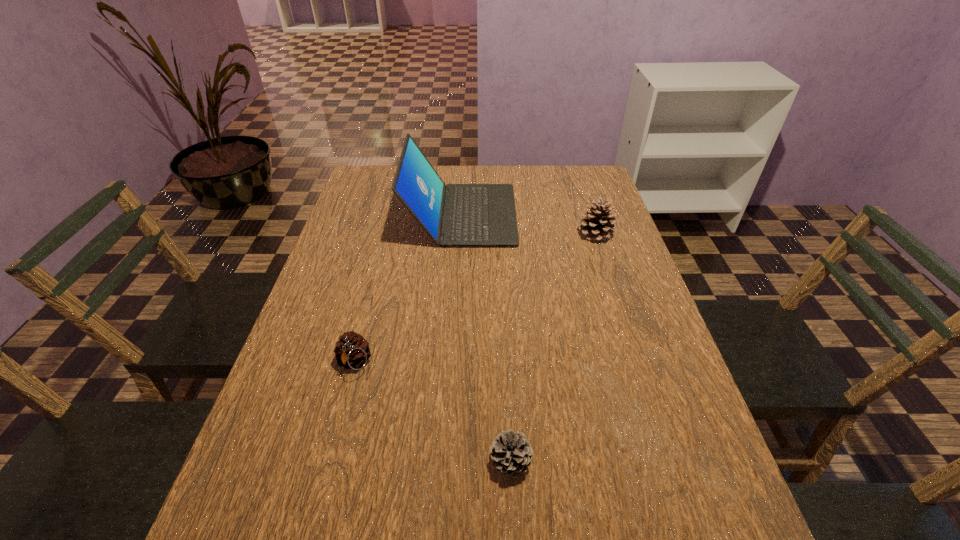
Locate an element on the screen. The height and width of the screenshot is (540, 960). free space between the second tallest object and the tallest object is located at coordinates (528, 224).

Where is `empty space between the farthest pinecone and the tallest object`? empty space between the farthest pinecone and the tallest object is located at coordinates (x=528, y=224).

Locate an element on the screen. empty location between the rightmost pinecone and the second pinecone from right to left is located at coordinates (553, 348).

Image resolution: width=960 pixels, height=540 pixels. What are the coordinates of `vacant area between the nearest pinecone and the second farthest pinecone` in the screenshot? It's located at (432, 412).

Image resolution: width=960 pixels, height=540 pixels. Identify the location of vacant space that is in between the tallest object and the nearest pinecone. (486, 338).

This screenshot has height=540, width=960. I want to click on vacant area between the leftmost pinecone and the rightmost pinecone, so click(474, 298).

Find the location of `vacant point located between the farthest pinecone and the second pinecone from right to left`. vacant point located between the farthest pinecone and the second pinecone from right to left is located at coordinates point(553,348).

The height and width of the screenshot is (540, 960). I want to click on vacant point located between the tallest object and the tallest pinecone, so click(528, 224).

This screenshot has height=540, width=960. I want to click on the third closest object to the nearest object, so click(x=597, y=224).

I want to click on the third closest object to the second nearest object, so click(597, 224).